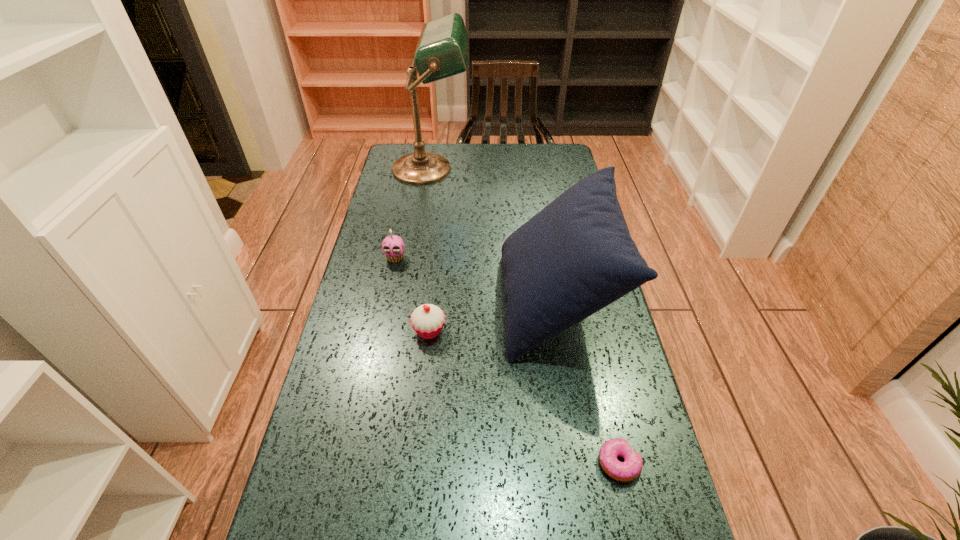
Locate an element on the screen. The height and width of the screenshot is (540, 960). blank area in the image that satisfies the following two spatial constraints: 1. above the green lampshade of the table lamp; 2. on the back side of the second shortest object is located at coordinates (406, 331).

Where is `blank area in the image that satisfies the following two spatial constraints: 1. on the face of the shorter cupcake; 2. on the left side of the taller cupcake`? This screenshot has width=960, height=540. blank area in the image that satisfies the following two spatial constraints: 1. on the face of the shorter cupcake; 2. on the left side of the taller cupcake is located at coordinates (380, 331).

At what (x,y) coordinates should I click in order to perform the action: click on free space that satisfies the following two spatial constraints: 1. above the green lampshade of the nearer cupcake; 2. on the left side of the farthest object. Please return your answer as a coordinate pair (x, y). The height and width of the screenshot is (540, 960). Looking at the image, I should click on (406, 331).